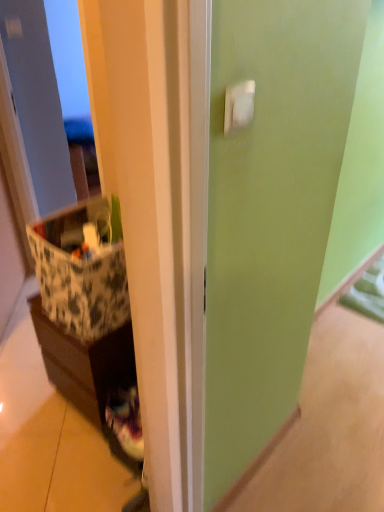
At what (x,y) coordinates should I click in order to perform the action: click on patterned fabric storage box at left. Please return your answer as a coordinate pair (x, y). This screenshot has width=384, height=512. Looking at the image, I should click on (80, 271).

This screenshot has height=512, width=384. Describe the element at coordinates (80, 271) in the screenshot. I see `patterned fabric storage box at left` at that location.

Find the location of a particular element. The image size is (384, 512). brown matte cabinet at left is located at coordinates (85, 364).

Image resolution: width=384 pixels, height=512 pixels. What do you see at coordinates (85, 364) in the screenshot? I see `brown matte cabinet at left` at bounding box center [85, 364].

In order to face brown matte cabinet at left, should I rotate leftwards or rightwards?

Turn left by 10.726 degrees to look at brown matte cabinet at left.

This screenshot has height=512, width=384. I want to click on patterned fabric storage box at left, so click(80, 271).

Considering the relative positions of patterned fabric storage box at left and brown matte cabinet at left in the image provided, is patterned fabric storage box at left to the right of brown matte cabinet at left from the viewer's perspective?

Yes, patterned fabric storage box at left is to the right of brown matte cabinet at left.

Considering the positions of objects patterned fabric storage box at left and brown matte cabinet at left in the image provided, who is behind, patterned fabric storage box at left or brown matte cabinet at left?

Positioned behind is brown matte cabinet at left.

Considering the points (87, 311) and (130, 371), which point is behind, point (87, 311) or point (130, 371)?

Positioned behind is point (130, 371).

From the image's perspective, is patterned fabric storage box at left under brown matte cabinet at left?

Actually, patterned fabric storage box at left appears above brown matte cabinet at left in the image.

From a real-world perspective, between patterned fabric storage box at left and brown matte cabinet at left, who is vertically lower?

brown matte cabinet at left, from a real-world perspective.

Considering the relative sizes of patterned fabric storage box at left and brown matte cabinet at left in the image provided, is patterned fabric storage box at left thinner than brown matte cabinet at left?

Correct, the width of patterned fabric storage box at left is less than that of brown matte cabinet at left.

Is patterned fabric storage box at left taller than brown matte cabinet at left?

Incorrect, the height of patterned fabric storage box at left is not larger of that of brown matte cabinet at left.

Between patterned fabric storage box at left and brown matte cabinet at left, which one has larger size?

Bigger between the two is brown matte cabinet at left.

Can we say patterned fabric storage box at left lies outside brown matte cabinet at left?

patterned fabric storage box at left lies outside brown matte cabinet at left's area.

Consider the image. Is the surface of patterned fabric storage box at left in direct contact with brown matte cabinet at left?

No, patterned fabric storage box at left is not next to brown matte cabinet at left.

Is patterned fabric storage box at left turned away from brown matte cabinet at left?

No, patterned fabric storage box at left is not facing the opposite direction of brown matte cabinet at left.

Can you tell me how much patterned fabric storage box at left and brown matte cabinet at left differ in facing direction?

The facing directions of patterned fabric storage box at left and brown matte cabinet at left are 5.37e-05 degrees apart.

How far apart are patterned fabric storage box at left and brown matte cabinet at left?

8.73 inches.

Find the location of `cabinetry below the patterned fabric storage box at left (from a real-world perspective)`. cabinetry below the patterned fabric storage box at left (from a real-world perspective) is located at coordinates (85, 364).

Which is more to the right, brown matte cabinet at left or patterned fabric storage box at left?

A: patterned fabric storage box at left is more to the right.

Which object is closer to the camera taking this photo, brown matte cabinet at left or patterned fabric storage box at left?

patterned fabric storage box at left.

Which point is more distant from viewer, (75, 354) or (106, 321)?

The point (75, 354) is farther from the camera.

From the image's perspective, who appears lower, brown matte cabinet at left or patterned fabric storage box at left?

brown matte cabinet at left, from the image's perspective.

From a real-world perspective, is brown matte cabinet at left over patterned fabric storage box at left?

No, from a real-world perspective, brown matte cabinet at left is not above patterned fabric storage box at left.

Does brown matte cabinet at left have a lesser width compared to patterned fabric storage box at left?

In fact, brown matte cabinet at left might be wider than patterned fabric storage box at left.

From the picture: Which of these two, brown matte cabinet at left or patterned fabric storage box at left, stands shorter?

Standing shorter between the two is patterned fabric storage box at left.

Considering the sizes of objects brown matte cabinet at left and patterned fabric storage box at left in the image provided, who is bigger, brown matte cabinet at left or patterned fabric storage box at left?

With larger size is brown matte cabinet at left.

Based on the photo, would you say brown matte cabinet at left is inside or outside patterned fabric storage box at left?

The correct answer is: outside.

From the picture: Is brown matte cabinet at left placed right next to patterned fabric storage box at left?

No, brown matte cabinet at left is not with patterned fabric storage box at left.

Does brown matte cabinet at left turn towards patterned fabric storage box at left?

No, brown matte cabinet at left is not aimed at patterned fabric storage box at left.

What's the angular difference between brown matte cabinet at left and patterned fabric storage box at left's facing directions?

The facing directions of brown matte cabinet at left and patterned fabric storage box at left are 5.37e-05 degrees apart.

Image resolution: width=384 pixels, height=512 pixels. What are the coordinates of `storage box that appears above the brown matte cabinet at left (from the image's perspective)` in the screenshot? It's located at (80, 271).

Locate an element on the screen. The width and height of the screenshot is (384, 512). cabinetry below the patterned fabric storage box at left (from the image's perspective) is located at coordinates (85, 364).

I want to click on cabinetry on the left of patterned fabric storage box at left, so click(x=85, y=364).